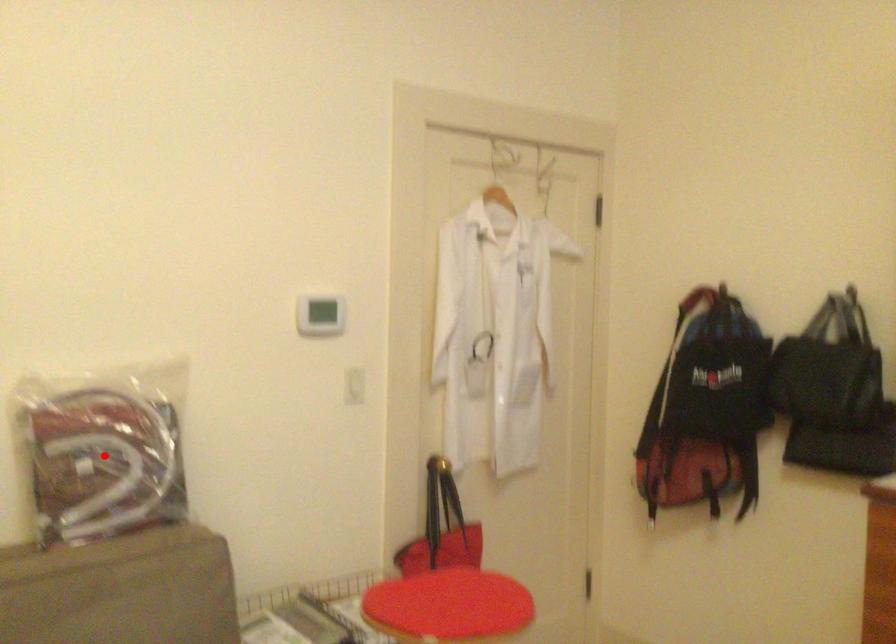
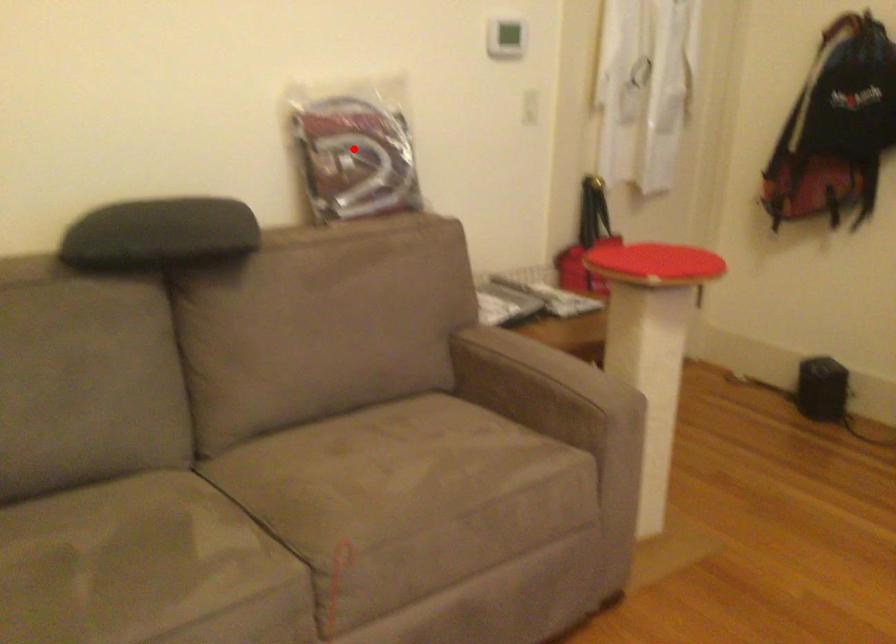
I am providing you with two images of the same scene from different viewpoints. A red point is marked on the first image and another point is marked on the second image. Is the red point in image1 aligned with the point shown in image2?

Yes